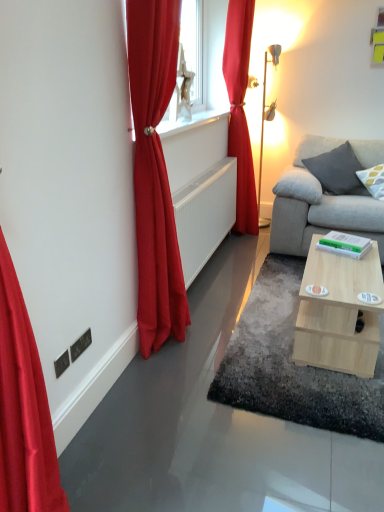
Where is `vacant space underneath white metallic radiator at center (from a real-world perspective)`? Image resolution: width=384 pixels, height=512 pixels. vacant space underneath white metallic radiator at center (from a real-world perspective) is located at coordinates (211, 271).